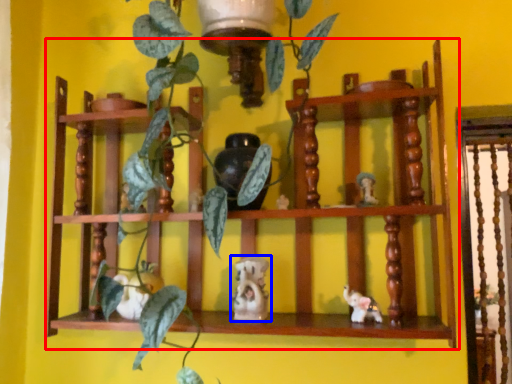
Question: Which object appears closest to the camera in this image, shelf (highlighted by a red box) or toy (highlighted by a blue box)?

Choices:
 (A) shelf
 (B) toy

Answer: (A)